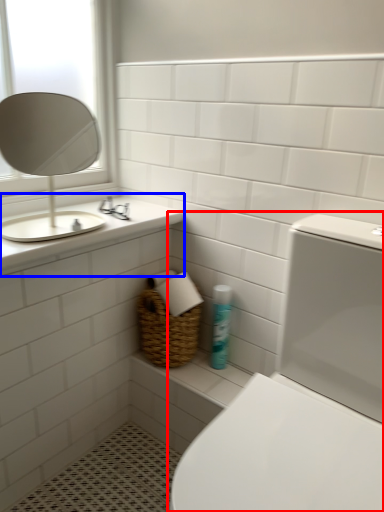
Question: Which point is closer to the camera, toilet (highlighted by a red box) or counter top (highlighted by a blue box)?

Choices:
 (A) toilet
 (B) counter top

Answer: (A)